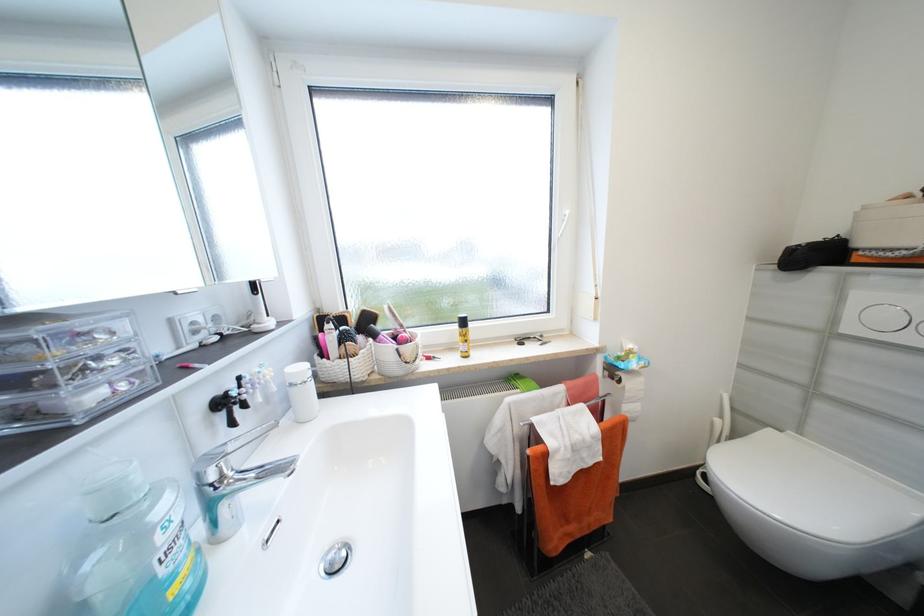
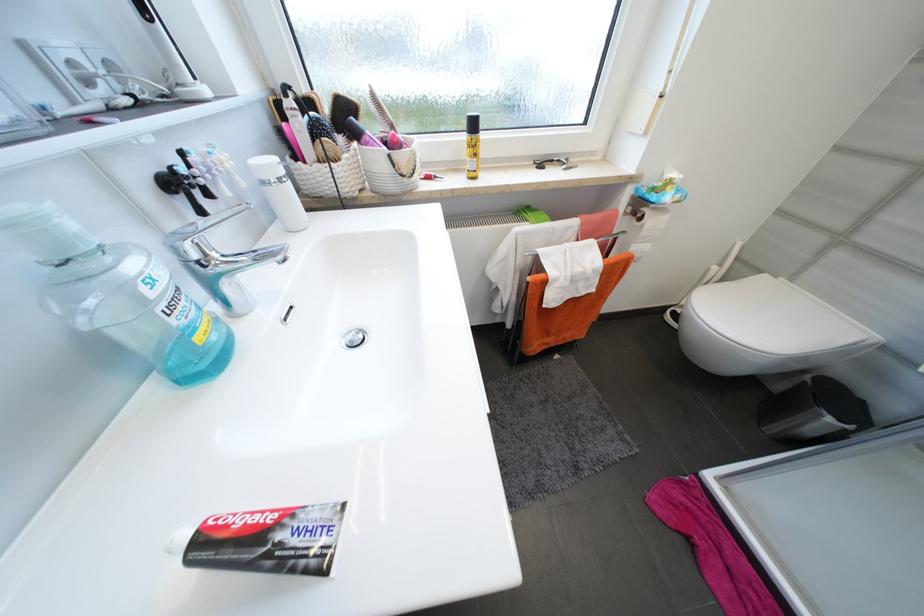
Where in the second image is the point corresponding to [380,336] from the first image?

(362, 136)